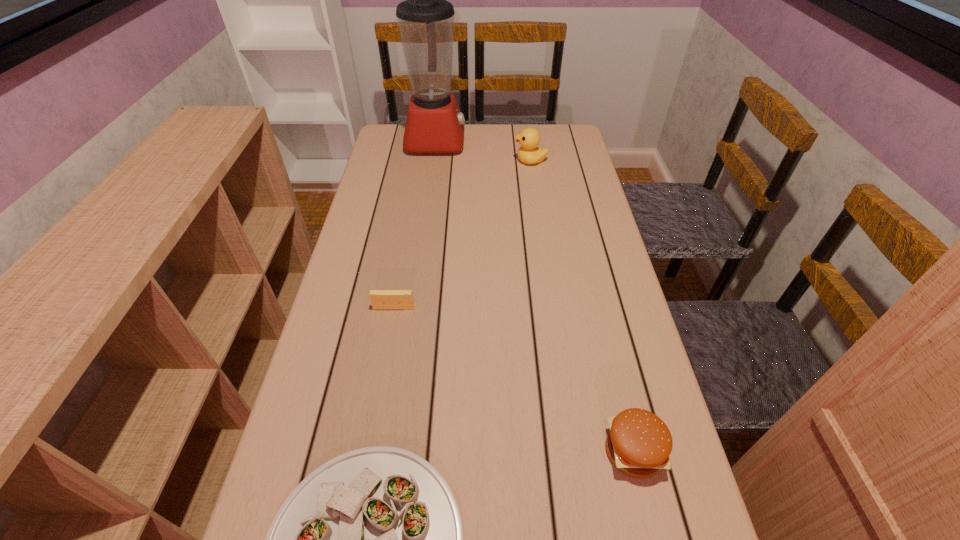
This screenshot has width=960, height=540. I want to click on blender, so click(434, 124).

You are a GUI agent. You are given a task and a screenshot of the screen. Output one action in this format:
    pyautogui.click(x=<x>, y=<y>)
    Task: Click on the duck
    Image resolution: width=960 pixels, height=540 pixels.
    Given the screenshot: What is the action you would take?
    pyautogui.click(x=529, y=138)

I want to click on the second tallest object, so click(x=529, y=138).

Where is `the rightmost object`? the rightmost object is located at coordinates (638, 443).

Locate an element on the screen. The width and height of the screenshot is (960, 540). hamburger is located at coordinates (638, 443).

What are the coordinates of `the third nearest object` in the screenshot? It's located at (380, 299).

Find the location of `vacant space situated 0.100m on the front of the tallest object near the controls`. vacant space situated 0.100m on the front of the tallest object near the controls is located at coordinates (492, 141).

The image size is (960, 540). Find the location of `blank space located on the face of the fourth shortest object`. blank space located on the face of the fourth shortest object is located at coordinates (491, 161).

Locate an element on the screen. vacant space located on the face of the fourth shortest object is located at coordinates (431, 161).

You are a GUI agent. You are given a task and a screenshot of the screen. Output one action in this format:
    pyautogui.click(x=<x>, y=<y>)
    Task: Click on the vacant position located 0.080m on the face of the fourth shortest object
    Image resolution: width=960 pixels, height=540 pixels.
    Given the screenshot: What is the action you would take?
    pyautogui.click(x=491, y=161)